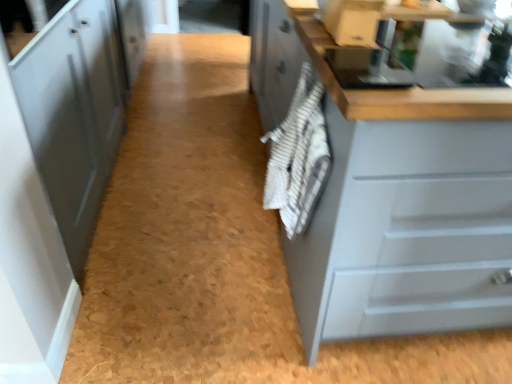
What do you see at coordinates (393, 197) in the screenshot?
I see `matte gray cabinet at right, positioned as the first cabinetry in right-to-left order` at bounding box center [393, 197].

The width and height of the screenshot is (512, 384). Describe the element at coordinates (298, 156) in the screenshot. I see `white striped towel at center` at that location.

Locate an element on the screen. The width and height of the screenshot is (512, 384). matte gray cabinet at left, which is the 2th cabinetry in right-to-left order is located at coordinates (48, 197).

Looking at their sizes, would you say matte gray cabinet at right, which ranks as the second cabinetry in left-to-right order, is wider or thinner than white striped towel at center?

In the image, matte gray cabinet at right, which ranks as the second cabinetry in left-to-right order, appears to be wider than white striped towel at center.

Between matte gray cabinet at right, which ranks as the second cabinetry in left-to-right order, and white striped towel at center, which one appears on the left side from the viewer's perspective?

white striped towel at center is more to the left.

In the scene shown: Is matte gray cabinet at right, which ranks as the second cabinetry in left-to-right order, looking in the opposite direction of white striped towel at center?

No, matte gray cabinet at right, which ranks as the second cabinetry in left-to-right order,'s orientation is not away from white striped towel at center.

Consider the image. Is the surface of white striped towel at center in direct contact with matte gray cabinet at right, positioned as the first cabinetry in right-to-left order?

No, white striped towel at center is not next to matte gray cabinet at right, positioned as the first cabinetry in right-to-left order.

Which object is wider, white striped towel at center or matte gray cabinet at right, positioned as the first cabinetry in right-to-left order?

matte gray cabinet at right, positioned as the first cabinetry in right-to-left order, is wider.

Is matte gray cabinet at left, marked as the 1th cabinetry in a left-to-right arrangement, bigger or smaller than white striped towel at center?

In the image, matte gray cabinet at left, marked as the 1th cabinetry in a left-to-right arrangement, appears to be larger than white striped towel at center.

Is matte gray cabinet at left, which is the 2th cabinetry in right-to-left order, inside or outside of white striped towel at center?

matte gray cabinet at left, which is the 2th cabinetry in right-to-left order, cannot be found inside white striped towel at center.

From a real-world perspective, is matte gray cabinet at left, marked as the 1th cabinetry in a left-to-right arrangement, located beneath white striped towel at center?

Yes.

Considering the positions of point (103, 28) and point (272, 164), is point (103, 28) closer or farther from the camera than point (272, 164)?

Point (103, 28) is positioned farther from the camera compared to point (272, 164).

How different are the orientations of white striped towel at center and matte gray cabinet at left, marked as the 1th cabinetry in a left-to-right arrangement, in degrees?

They differ by 178 degrees in their facing directions.

Considering the positions of objects white striped towel at center and matte gray cabinet at left, marked as the 1th cabinetry in a left-to-right arrangement, in the image provided, who is more to the right, white striped towel at center or matte gray cabinet at left, marked as the 1th cabinetry in a left-to-right arrangement,?

From the viewer's perspective, white striped towel at center appears more on the right side.

From a real-world perspective, count 1st cabinetrys downward from the white striped towel at center and point to it. Please provide its 2D coordinates.

[(48, 197)]

From a real-world perspective, who is located lower, white striped towel at center or matte gray cabinet at left, which is the 2th cabinetry in right-to-left order?

matte gray cabinet at left, which is the 2th cabinetry in right-to-left order, from a real-world perspective.

Can you confirm if matte gray cabinet at left, marked as the 1th cabinetry in a left-to-right arrangement, is wider than matte gray cabinet at right, which ranks as the second cabinetry in left-to-right order?

In fact, matte gray cabinet at left, marked as the 1th cabinetry in a left-to-right arrangement, might be narrower than matte gray cabinet at right, which ranks as the second cabinetry in left-to-right order.

Does matte gray cabinet at left, which is the 2th cabinetry in right-to-left order, have a greater height compared to matte gray cabinet at right, which ranks as the second cabinetry in left-to-right order?

Yes, matte gray cabinet at left, which is the 2th cabinetry in right-to-left order, is taller than matte gray cabinet at right, which ranks as the second cabinetry in left-to-right order.

Who is bigger, matte gray cabinet at left, marked as the 1th cabinetry in a left-to-right arrangement, or matte gray cabinet at right, positioned as the first cabinetry in right-to-left order?

matte gray cabinet at left, marked as the 1th cabinetry in a left-to-right arrangement, is bigger.

Where is `cabinetry that appears above the matte gray cabinet at right, which ranks as the second cabinetry in left-to-right order (from the image's perspective)`? This screenshot has height=384, width=512. cabinetry that appears above the matte gray cabinet at right, which ranks as the second cabinetry in left-to-right order (from the image's perspective) is located at coordinates (48, 197).

Measure the distance from matte gray cabinet at right, positioned as the first cabinetry in right-to-left order, to matte gray cabinet at left, marked as the 1th cabinetry in a left-to-right arrangement.

37.67 inches.

Consider the image. Is matte gray cabinet at right, which ranks as the second cabinetry in left-to-right order, not close to matte gray cabinet at left, marked as the 1th cabinetry in a left-to-right arrangement?

No, matte gray cabinet at right, which ranks as the second cabinetry in left-to-right order, is in close proximity to matte gray cabinet at left, marked as the 1th cabinetry in a left-to-right arrangement.

Is matte gray cabinet at right, which ranks as the second cabinetry in left-to-right order, inside or outside of matte gray cabinet at left, which is the 2th cabinetry in right-to-left order?

matte gray cabinet at right, which ranks as the second cabinetry in left-to-right order, cannot be found inside matte gray cabinet at left, which is the 2th cabinetry in right-to-left order.

I want to click on material on the left of matte gray cabinet at right, positioned as the first cabinetry in right-to-left order, so click(x=298, y=156).

Find the location of a particular element. The image size is (512, 384). cabinetry below the white striped towel at center (from the image's perspective) is located at coordinates (393, 197).

Considering their positions, is white striped towel at center positioned further to matte gray cabinet at left, which is the 2th cabinetry in right-to-left order, than matte gray cabinet at right, which ranks as the second cabinetry in left-to-right order?

matte gray cabinet at right, which ranks as the second cabinetry in left-to-right order, is further to matte gray cabinet at left, which is the 2th cabinetry in right-to-left order.

When comparing their distances from white striped towel at center, does matte gray cabinet at left, marked as the 1th cabinetry in a left-to-right arrangement, or matte gray cabinet at right, which ranks as the second cabinetry in left-to-right order, seem further?

The object further to white striped towel at center is matte gray cabinet at left, marked as the 1th cabinetry in a left-to-right arrangement.

Based on the photo, considering their positions, is white striped towel at center positioned further to matte gray cabinet at right, positioned as the first cabinetry in right-to-left order, than matte gray cabinet at left, marked as the 1th cabinetry in a left-to-right arrangement?

The object further to matte gray cabinet at right, positioned as the first cabinetry in right-to-left order, is matte gray cabinet at left, marked as the 1th cabinetry in a left-to-right arrangement.

Based on their spatial positions, is matte gray cabinet at right, which ranks as the second cabinetry in left-to-right order, or white striped towel at center further from matte gray cabinet at left, marked as the 1th cabinetry in a left-to-right arrangement?

Among the two, matte gray cabinet at right, which ranks as the second cabinetry in left-to-right order, is located further to matte gray cabinet at left, marked as the 1th cabinetry in a left-to-right arrangement.

Looking at the image, which one is located further to matte gray cabinet at right, which ranks as the second cabinetry in left-to-right order, matte gray cabinet at left, which is the 2th cabinetry in right-to-left order, or white striped towel at center?

matte gray cabinet at left, which is the 2th cabinetry in right-to-left order, is further to matte gray cabinet at right, which ranks as the second cabinetry in left-to-right order.

Which object lies further to the anchor point white striped towel at center, matte gray cabinet at right, positioned as the first cabinetry in right-to-left order, or matte gray cabinet at left, marked as the 1th cabinetry in a left-to-right arrangement?

matte gray cabinet at left, marked as the 1th cabinetry in a left-to-right arrangement, is positioned further to the anchor white striped towel at center.

Locate an element on the screen. material between matte gray cabinet at left, marked as the 1th cabinetry in a left-to-right arrangement, and matte gray cabinet at right, positioned as the first cabinetry in right-to-left order, in the horizontal direction is located at coordinates (298, 156).